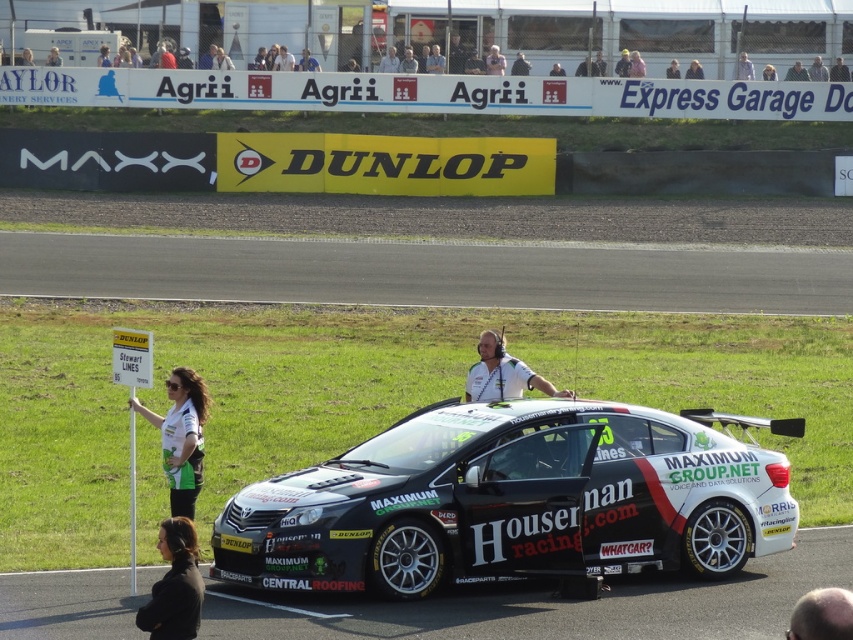
Question: Which of the following is the farthest from the observer?

Choices:
 (A) asphalt at center
 (B) gray bald head at lower right
 (C) black fabric at lower left

Answer: (A)

Question: Where is black rubber race track at lower center located in relation to light brown hair at center in the image?

Choices:
 (A) below
 (B) above

Answer: (A)

Question: Can you confirm if dirt track at center is positioned to the left of light brown leather jacket at upper center?

Choices:
 (A) no
 (B) yes

Answer: (B)

Question: Which object is the closest to the light brown hair at center?

Choices:
 (A) black fabric at lower left
 (B) dirt track at center

Answer: (B)

Question: Is black fabric at lower left below gray bald head at lower right?

Choices:
 (A) yes
 (B) no

Answer: (A)

Question: Which point is closer to the camera taking this photo?

Choices:
 (A) (213, 292)
 (B) (370, 556)

Answer: (B)